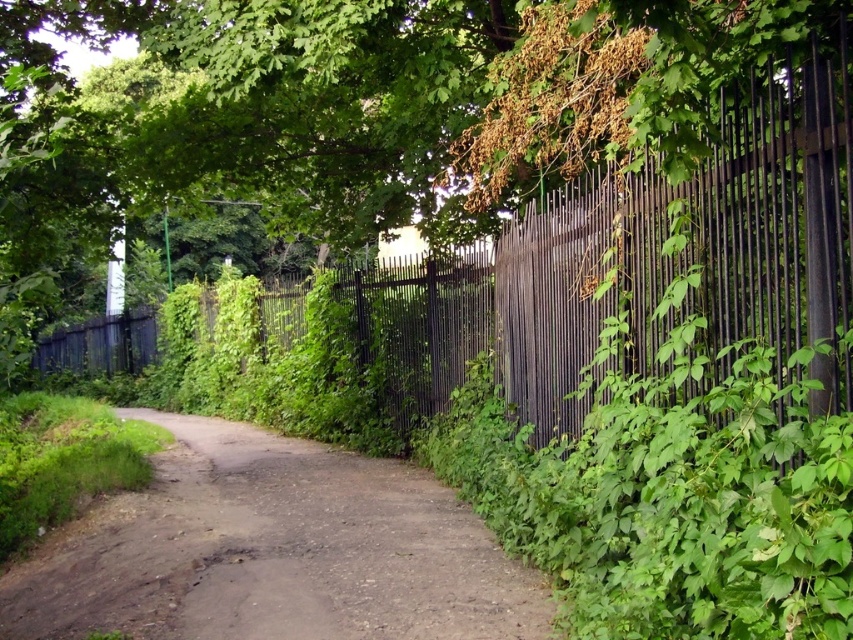
Question: Does brown dirt track at center have a larger size compared to black metal fence at right?

Choices:
 (A) no
 (B) yes

Answer: (B)

Question: Which of the following is the closest to the observer?

Choices:
 (A) black metal fence at center
 (B) brown dirt track at center
 (C) black metal fence at right

Answer: (B)

Question: Which object is closer to the camera taking this photo?

Choices:
 (A) black metal fence at right
 (B) black metal fence at center

Answer: (A)

Question: Does brown dirt track at center have a smaller size compared to black metal fence at center?

Choices:
 (A) no
 (B) yes

Answer: (B)

Question: Estimate the real-world distances between objects in this image. Which object is closer to the black metal fence at center?

Choices:
 (A) black metal fence at right
 (B) brown dirt track at center

Answer: (B)

Question: In this image, where is brown dirt track at center located relative to black metal fence at center?

Choices:
 (A) below
 (B) above

Answer: (A)